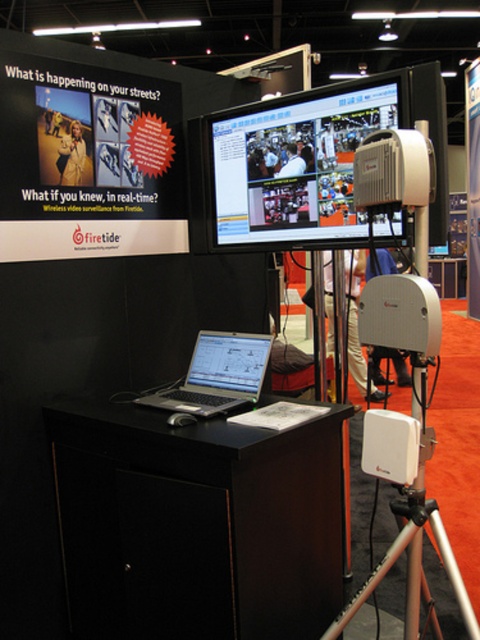
Question: Can you confirm if satin silver laptop at center is smaller than white plastic projector at center?

Choices:
 (A) yes
 (B) no

Answer: (B)

Question: Among these points, which one is nearest to the camera?

Choices:
 (A) (179, 396)
 (B) (364, 172)

Answer: (B)

Question: Which object is closer to the camera taking this photo?

Choices:
 (A) satin silver laptop at center
 (B) white plastic projector at center

Answer: (B)

Question: Which of the following is the farthest from the observer?

Choices:
 (A) (266, 360)
 (B) (376, 161)

Answer: (A)

Question: Can you confirm if satin silver laptop at center is smaller than white plastic projector at center?

Choices:
 (A) yes
 (B) no

Answer: (B)

Question: Is satin silver laptop at center thinner than white plastic projector at center?

Choices:
 (A) yes
 (B) no

Answer: (B)